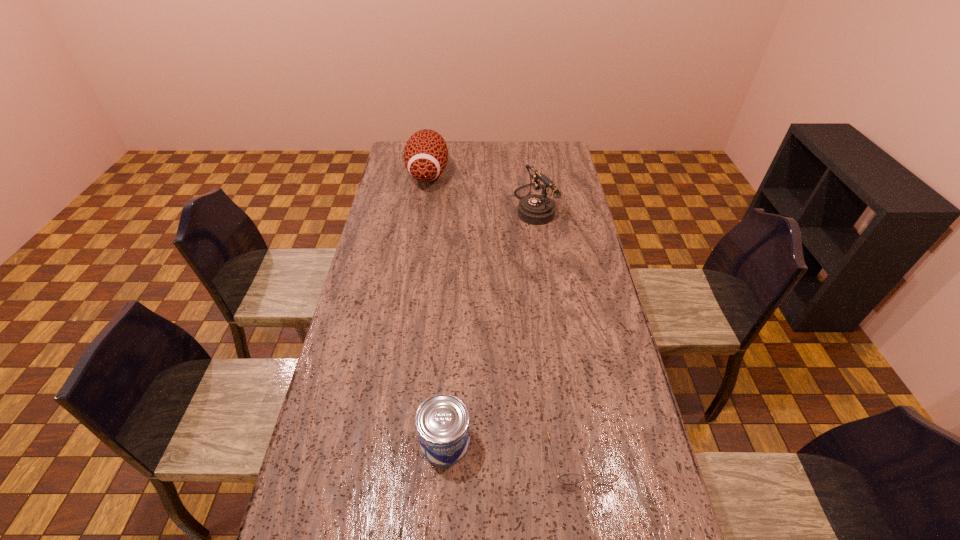
Locate an element on the screen. This screenshot has height=540, width=960. telephone that is at the right edge is located at coordinates (535, 209).

Where is `spectacles situated at the right edge`? Image resolution: width=960 pixels, height=540 pixels. spectacles situated at the right edge is located at coordinates pos(567,478).

Locate an element on the screen. The width and height of the screenshot is (960, 540). object present at the far left corner is located at coordinates (426, 154).

This screenshot has width=960, height=540. Find the location of `vacant space at the far edge of the desktop`. vacant space at the far edge of the desktop is located at coordinates (481, 163).

Locate an element on the screen. vacant space at the left edge is located at coordinates point(364,358).

In the image, there is a desktop. Identify the location of vacant space at the right edge. (598, 268).

The height and width of the screenshot is (540, 960). In order to click on free space at the far right corner of the desktop in this screenshot , I will do `click(535, 147)`.

Identify the location of free space between the tallest object and the spectacles. The width and height of the screenshot is (960, 540). (505, 315).

Where is `vacant space in between the telephone and the football`? This screenshot has height=540, width=960. vacant space in between the telephone and the football is located at coordinates [x=481, y=189].

This screenshot has width=960, height=540. I want to click on vacant space that's between the tallest object and the second tallest object, so click(481, 189).